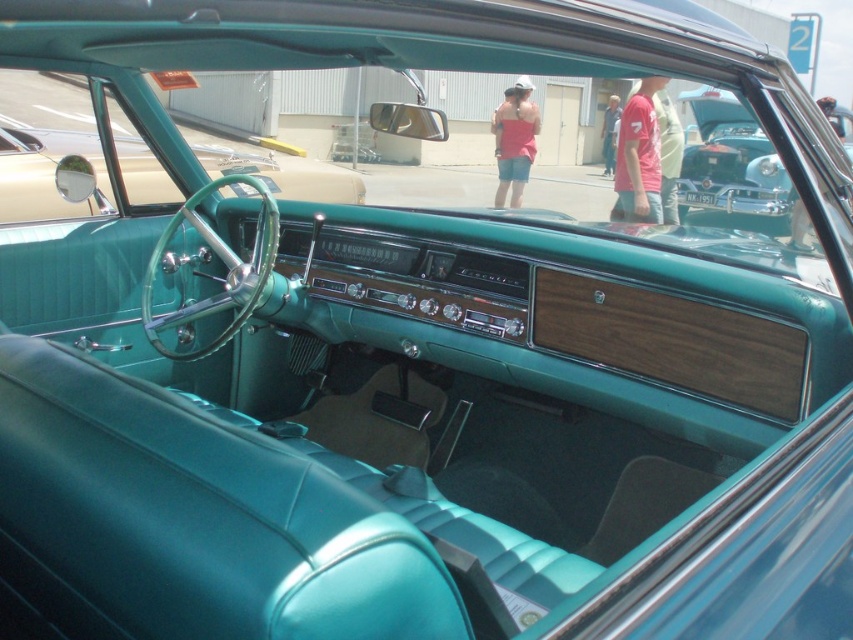
Is point (137, 198) positioned behind point (728, 192)?

No, (137, 198) is in front of (728, 192).

Between point (316, 200) and point (758, 160), which one is positioned behind?

The point (758, 160) is behind.

Which is in front, point (67, 145) or point (737, 225)?

Point (67, 145)

Locate an element on the screen. teal leather steering wheel at center is located at coordinates point(44,172).